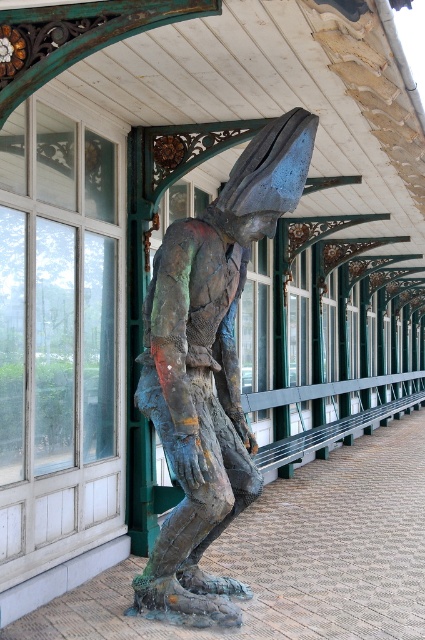
Does bronze textured figure at center appear on the left side of bronze statue at center?

Indeed, bronze textured figure at center is positioned on the left side of bronze statue at center.

Which is below, bronze textured figure at center or bronze statue at center?

bronze statue at center is lower down.

Where is `bronze textured figure at center`? Image resolution: width=425 pixels, height=640 pixels. bronze textured figure at center is located at coordinates (209, 369).